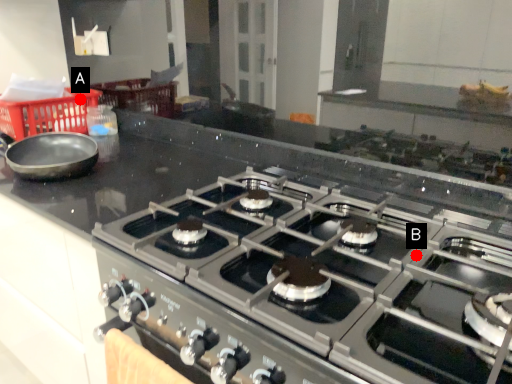
Question: Two points are circled on the image, labeled by A and B beside each circle. Which of the following is the closest to the observer?

Choices:
 (A) A is closer
 (B) B is closer

Answer: (B)